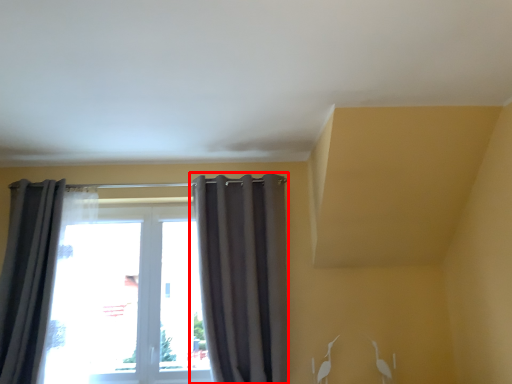
Question: From the image's perspective, considering the relative positions of curtain (annotated by the red box) and curtain in the image provided, where is curtain (annotated by the red box) located with respect to the staircase?

Choices:
 (A) below
 (B) above

Answer: (B)